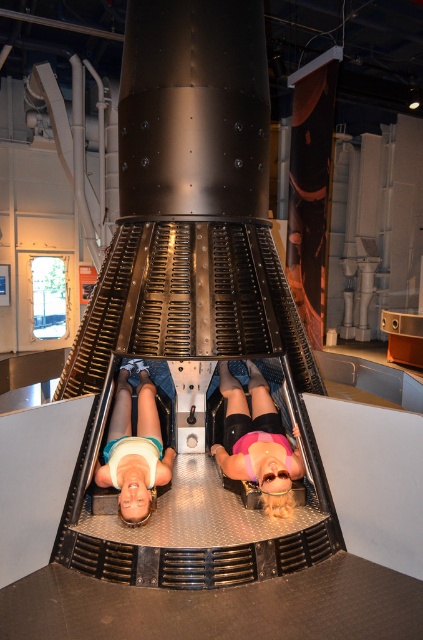
Question: Does pink matte shorts at center appear on the left side of matte white shirt at center?

Choices:
 (A) yes
 (B) no

Answer: (B)

Question: Which of the following is the farthest from the observer?

Choices:
 (A) pink matte shorts at center
 (B) matte white shirt at center

Answer: (A)

Question: Does pink matte shorts at center appear on the right side of matte white shirt at center?

Choices:
 (A) yes
 (B) no

Answer: (A)

Question: Which point appears closest to the camera in this image?

Choices:
 (A) (225, 460)
 (B) (129, 449)

Answer: (B)

Question: Can you confirm if pink matte shorts at center is smaller than matte white shirt at center?

Choices:
 (A) yes
 (B) no

Answer: (B)